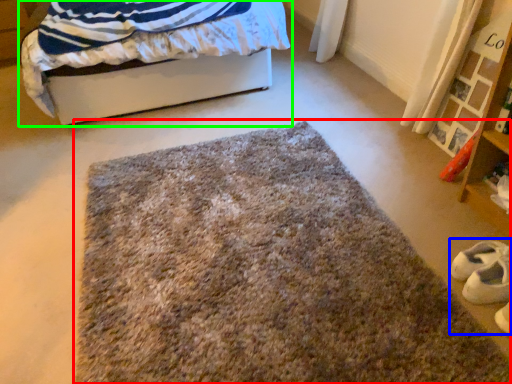
Question: Considering the real-world distances, which object is farthest from mat (highlighted by a red box)? shoe (highlighted by a blue box) or bed (highlighted by a green box)?

Choices:
 (A) shoe
 (B) bed

Answer: (B)